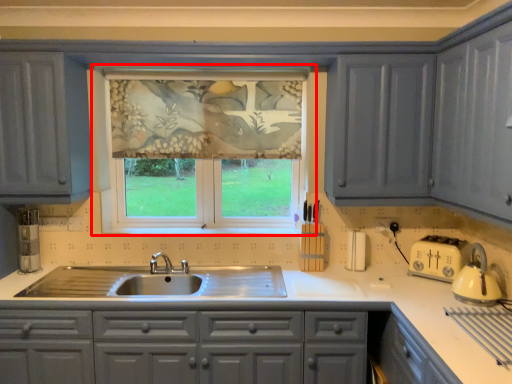
Question: From the image's perspective, what is the correct spatial relationship of window (annotated by the red box) in relation to countertop?

Choices:
 (A) above
 (B) below

Answer: (A)